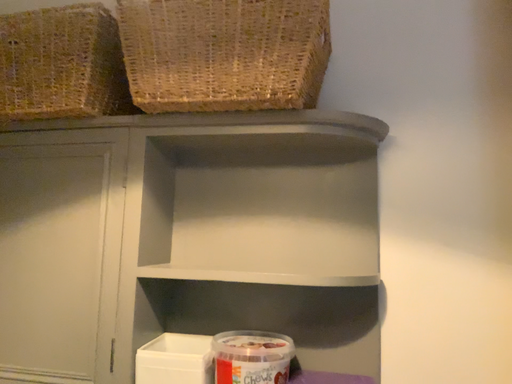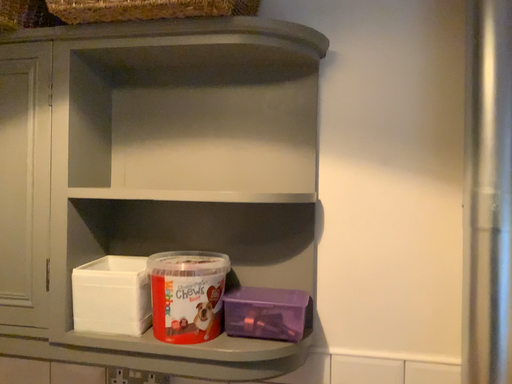
Question: How did the camera likely rotate when shooting the video?

Choices:
 (A) rotated downward
 (B) rotated upward

Answer: (A)